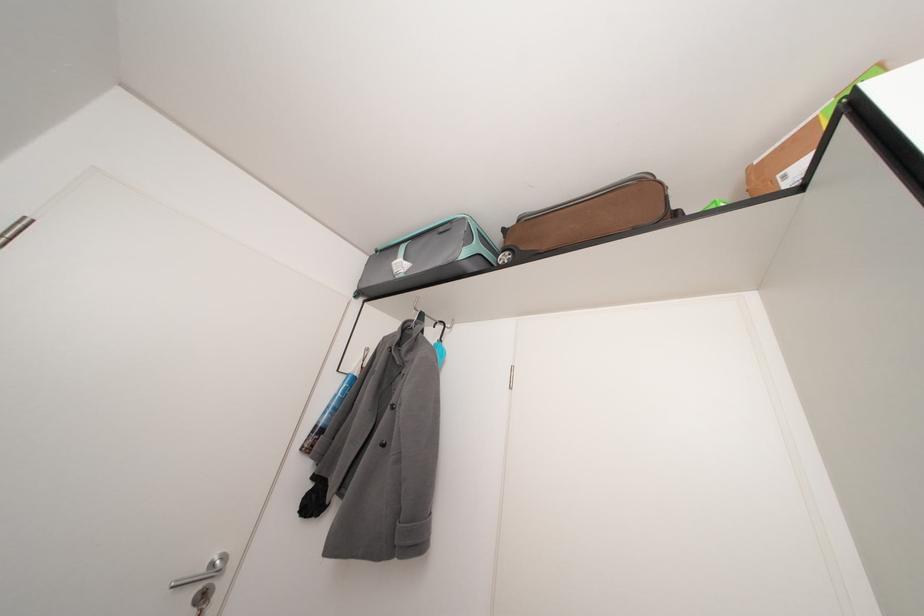
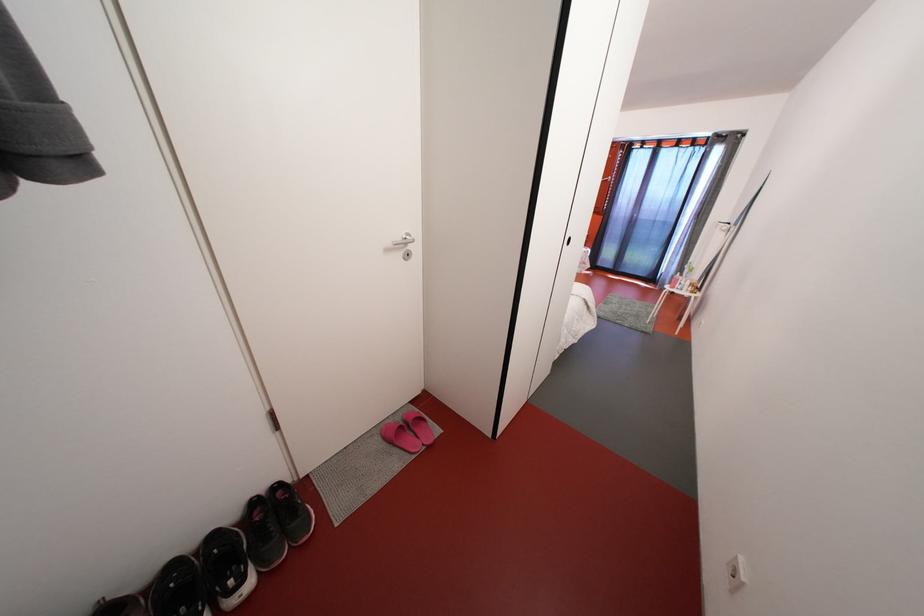
How did the camera likely rotate?

The rotation direction of the camera is right-down.